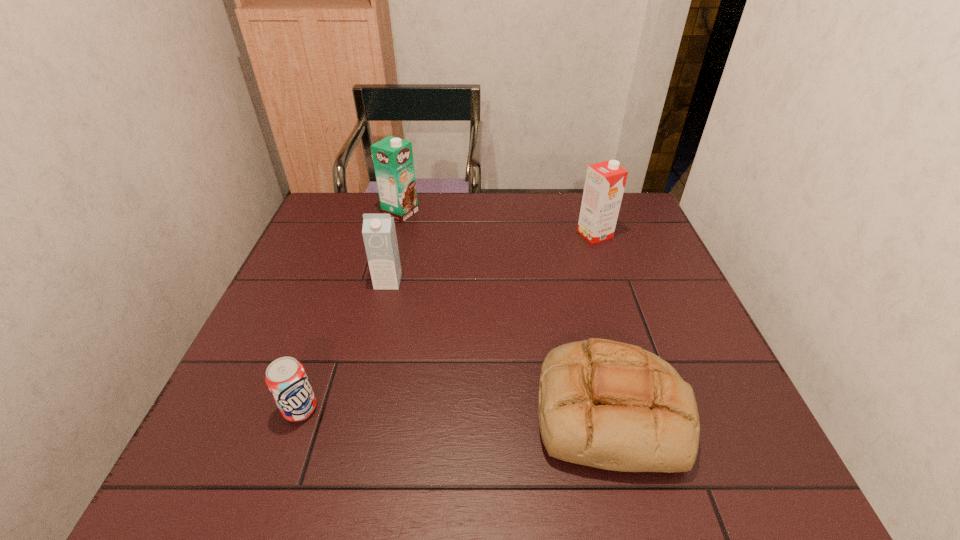
Where is `free space between the bread and the nearest carton`? This screenshot has height=540, width=960. free space between the bread and the nearest carton is located at coordinates (499, 346).

This screenshot has width=960, height=540. What are the coordinates of `vacant space that's between the nearest carton and the bread` in the screenshot? It's located at pyautogui.click(x=499, y=346).

You are a GUI agent. You are given a task and a screenshot of the screen. Output one action in this format:
    pyautogui.click(x=<x>, y=<y>)
    Task: Click on the free spot between the fourth nearest object and the third farthest object
    
    Given the screenshot: What is the action you would take?
    pyautogui.click(x=492, y=258)

Locate an element on the screen. The height and width of the screenshot is (540, 960). object that stands as the second closest to the bread is located at coordinates (604, 186).

Locate which object ranks third in proximity to the farthest carton. Please provide its 2D coordinates. Your answer should be formatted as a tuple, i.e. [(x, y)], where the tuple contains the x and y coordinates of a point satisfying the conditions above.

[(610, 405)]

Identify which carton is the closest to the farthest object. Please provide its 2D coordinates. Your answer should be formatted as a tuple, i.e. [(x, y)], where the tuple contains the x and y coordinates of a point satisfying the conditions above.

[(379, 234)]

This screenshot has height=540, width=960. Identify the location of carton identified as the closest to the third nearest object. (393, 161).

The image size is (960, 540). I want to click on vacant region that satisfies the following two spatial constraints: 1. on the front side of the second farthest carton; 2. on the right side of the farthest carton, so click(x=396, y=234).

Where is `vacant area that satisfies the following two spatial constraints: 1. on the back side of the second nearest carton; 2. on the left side of the leftmost object`? vacant area that satisfies the following two spatial constraints: 1. on the back side of the second nearest carton; 2. on the left side of the leftmost object is located at coordinates (361, 234).